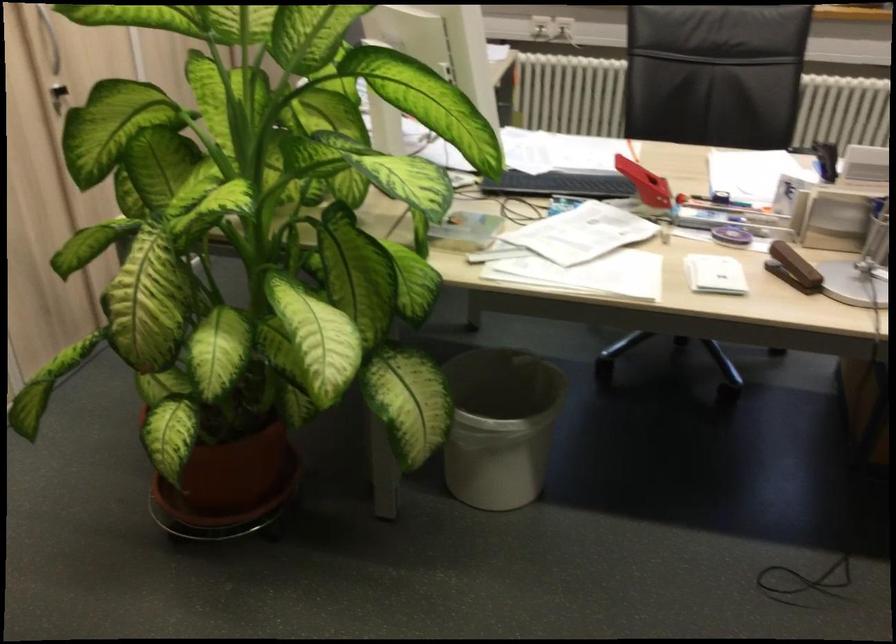
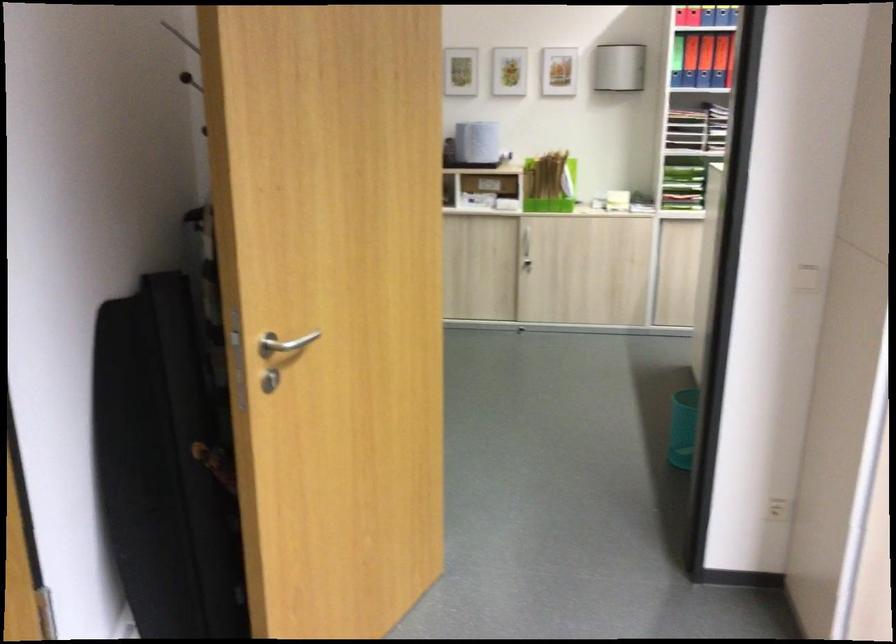
Question: The first image is from the beginning of the video and the second image is from the end. How did the camera likely rotate when shooting the video?

Choices:
 (A) Left
 (B) Right
 (C) Up
 (D) Down

Answer: (A)